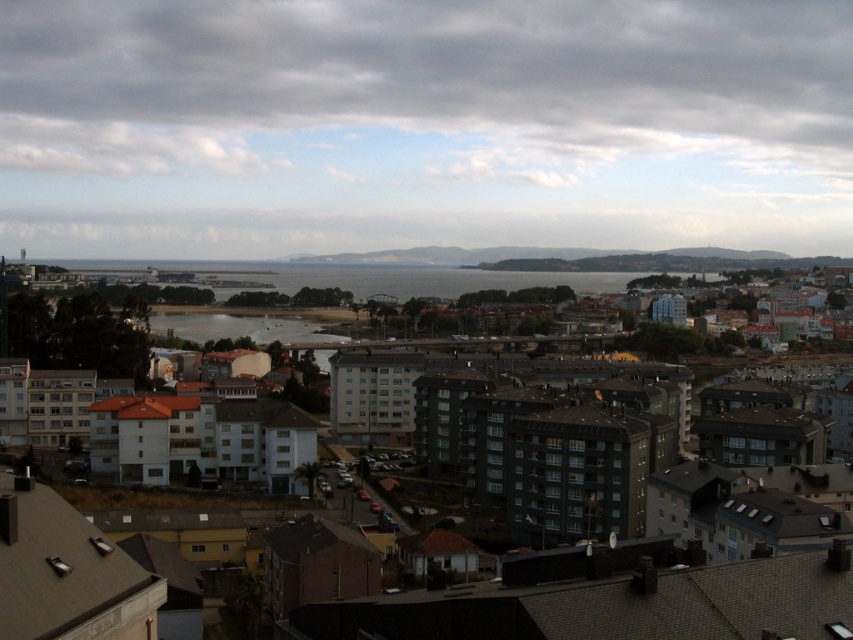
Question: Does matte gray buildings at center have a greater width compared to clear water at center?

Choices:
 (A) no
 (B) yes

Answer: (A)

Question: Does matte gray buildings at center appear under clear water at center?

Choices:
 (A) no
 (B) yes

Answer: (B)

Question: Is matte gray buildings at center below clear water at center?

Choices:
 (A) no
 (B) yes

Answer: (B)

Question: Which point is farther to the camera?

Choices:
 (A) clear water at center
 (B) matte gray buildings at center

Answer: (A)

Question: Which point is farther from the camera taking this photo?

Choices:
 (A) (521, 611)
 (B) (195, 324)

Answer: (B)

Question: Among these objects, which one is nearest to the camera?

Choices:
 (A) matte gray buildings at center
 (B) clear water at center

Answer: (A)